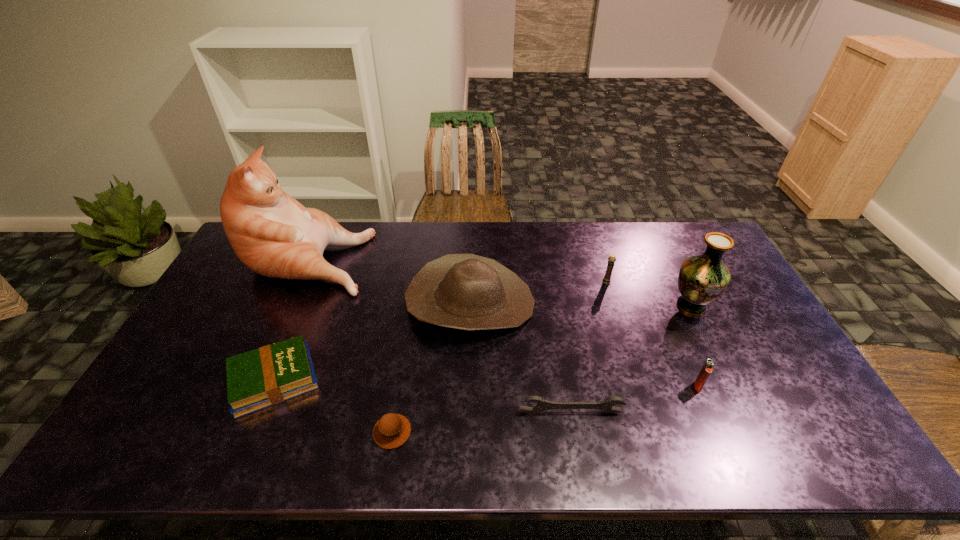
At what (x,y) coordinates should I click in order to perform the action: click on the tallest object. Please return your answer as a coordinate pair (x, y). Looking at the image, I should click on (274, 235).

The height and width of the screenshot is (540, 960). What are the coordinates of `the second tallest object` in the screenshot? It's located at (702, 279).

Identify the location of vase. The image size is (960, 540). (702, 279).

Image resolution: width=960 pixels, height=540 pixels. In order to click on cowboy hat in this screenshot , I will do `click(465, 291)`.

The width and height of the screenshot is (960, 540). I want to click on candle holder, so [x=611, y=260].

Image resolution: width=960 pixels, height=540 pixels. In order to click on the fourth tallest object in this screenshot , I will do `click(611, 260)`.

Locate an element on the screen. This screenshot has width=960, height=540. igniter is located at coordinates (707, 368).

At what (x,y) coordinates should I click in order to perform the action: click on the fourth shortest object. Please return your answer as a coordinate pair (x, y). This screenshot has height=540, width=960. Looking at the image, I should click on (707, 368).

The height and width of the screenshot is (540, 960). Find the location of `wrench`. wrench is located at coordinates (607, 405).

Find the location of a particular element. book is located at coordinates (271, 374).